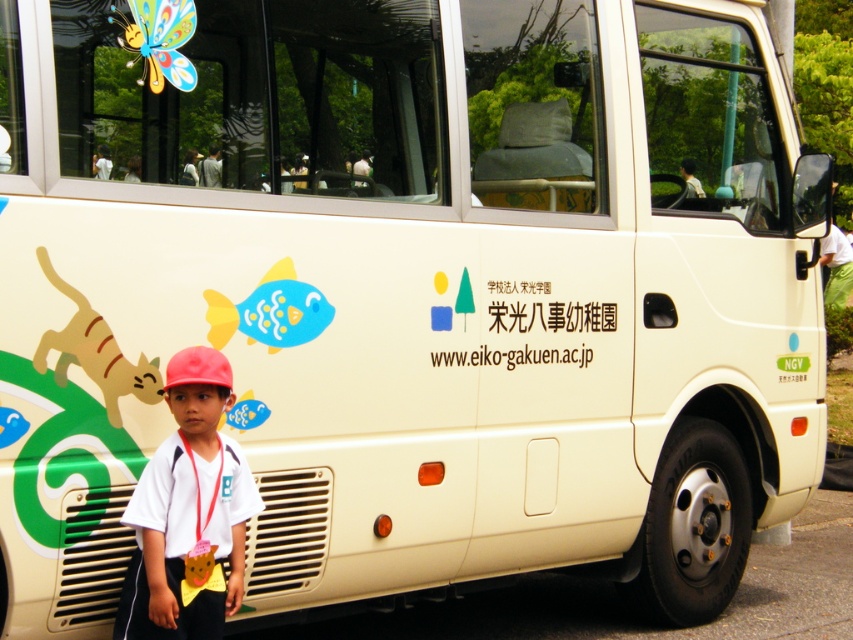
You are a photographer taking a picture of the school bus with the child. You notice two points on the bus, point A at coordinates point (222, 412) and point B at coordinates point (548, 328). Which point will appear larger in your photo?

Point A at coordinates point (222, 412) is closer to the viewer than point B at coordinates point (548, 328), so it will appear larger in the photo.

You are standing at the bus stop and see a child wearing a white matte shirt at lower left. The bus is about to depart. If you want to catch the bus, do you need to run towards the bus or away from the child?

The white matte shirt at lower left is 3.45 meters away from you. Since the bus is in front of the child, you should run towards the bus, which is in the opposite direction of the child.

Looking at this image, you are a photographer trying to capture the child in the scene. The child is wearing a white matte shirt at lower left and holding a white paper sign at center. Which object is taller when viewed from your camera lens?

The white matte shirt at lower left is taller than the white paper sign at center.